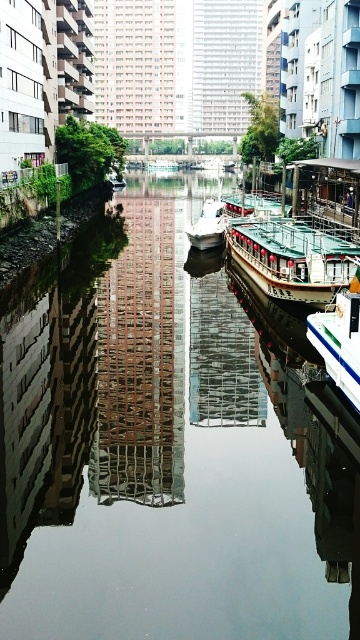
Is brick wall at center to the left of white glossy boat at right from the viewer's perspective?

Yes, brick wall at center is to the left of white glossy boat at right.

Is brick wall at center wider than white glossy boat at right?

Yes, brick wall at center is wider than white glossy boat at right.

This screenshot has width=360, height=640. Identify the location of brick wall at center. (141, 360).

You are a GUI agent. You are given a task and a screenshot of the screen. Output one action in this format:
    pyautogui.click(x=<x>, y=<y>)
    Task: Click on the brick wall at center
    The image size is (360, 640).
    Given the screenshot: What is the action you would take?
    pyautogui.click(x=141, y=360)

Does reflective glass water at center lie in front of white glossy boat at center?

Yes, it is.

Does reflective glass water at center have a greater height compared to white glossy boat at center?

Indeed, reflective glass water at center has a greater height compared to white glossy boat at center.

I want to click on reflective glass water at center, so [x=159, y=449].

Where is `reflective glass water at center`? This screenshot has width=360, height=640. reflective glass water at center is located at coordinates click(x=159, y=449).

Is reflective glass water at center shorter than wooden polished boat at center?

No.

Between point (261, 413) and point (267, 237), which one is positioned behind?

Point (267, 237)

The image size is (360, 640). In order to click on reflective glass water at center in this screenshot , I will do `click(159, 449)`.